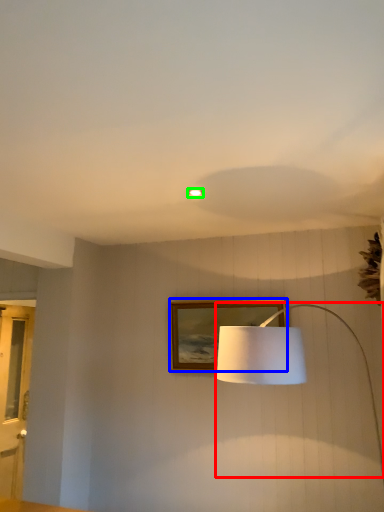
Question: Estimate the real-world distances between objects in this image. Which object is farther from lamp (highlighted by a red box), picture frame (highlighted by a blue box) or lighting (highlighted by a green box)?

Choices:
 (A) picture frame
 (B) lighting

Answer: (A)